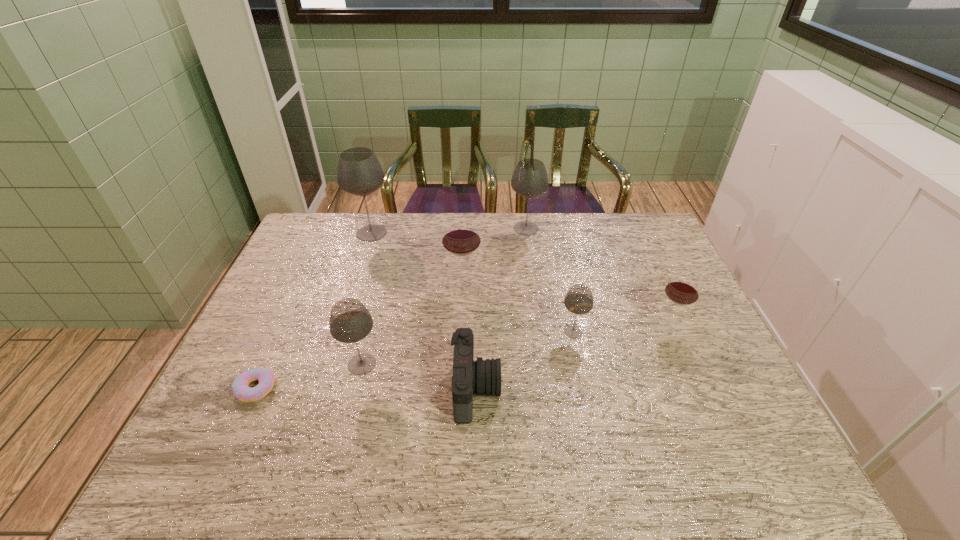
Where is `the smallest gray wineglass`? The image size is (960, 540). the smallest gray wineglass is located at coordinates (579, 300).

At what (x,y) coordinates should I click in order to perform the action: click on the second shortest object. Please return your answer as a coordinate pair (x, y). Looking at the image, I should click on (481, 376).

The width and height of the screenshot is (960, 540). What are the coordinates of `doughnut` in the screenshot? It's located at (240, 389).

At what (x,y) coordinates should I click in order to perform the action: click on the leftmost object. Please return your answer as a coordinate pair (x, y). The image size is (960, 540). Looking at the image, I should click on (240, 389).

You are a GUI agent. You are given a task and a screenshot of the screen. Output one action in this format:
    pyautogui.click(x=<x>, y=<y>)
    Task: Click on the free space located on the front of the tallest object
    The image size is (960, 540).
    Given the screenshot: What is the action you would take?
    pyautogui.click(x=345, y=316)

Find the location of `free space located 0.380m on the left of the third smallest gray wineglass`. free space located 0.380m on the left of the third smallest gray wineglass is located at coordinates (405, 228).

Where is `free spot located 0.150m on the back of the third wineglass from left to right`? This screenshot has width=960, height=540. free spot located 0.150m on the back of the third wineglass from left to right is located at coordinates (465, 243).

I want to click on blank area located 0.230m on the front of the second smallest gray wineglass, so click(x=335, y=470).

Identify the location of vacant space located on the front of the right red wineglass. The image size is (960, 540). (714, 427).

Identify the location of free space located on the left of the third farthest gray wineglass. (495, 331).